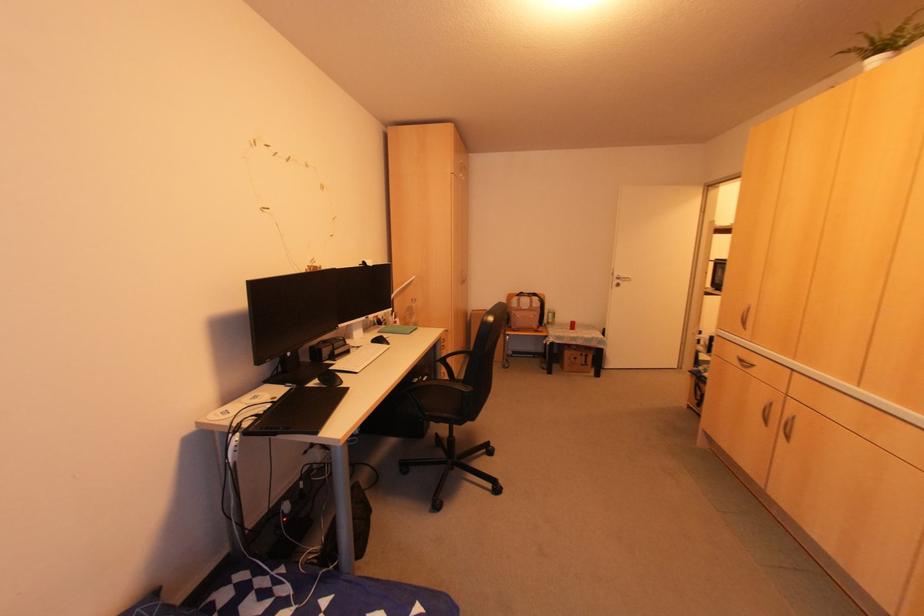
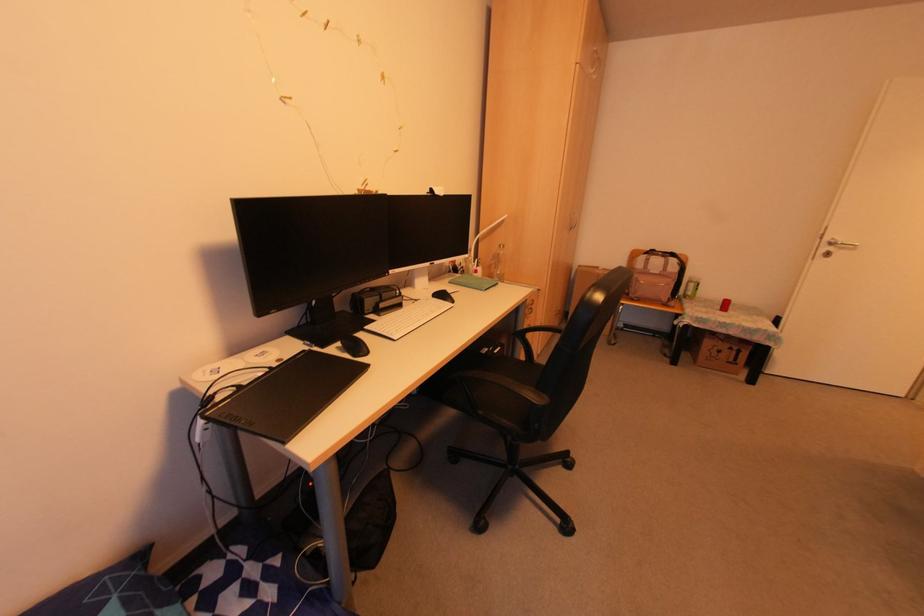
Find the pixel in the second image that matches (261,211) in the first image.

(283, 103)